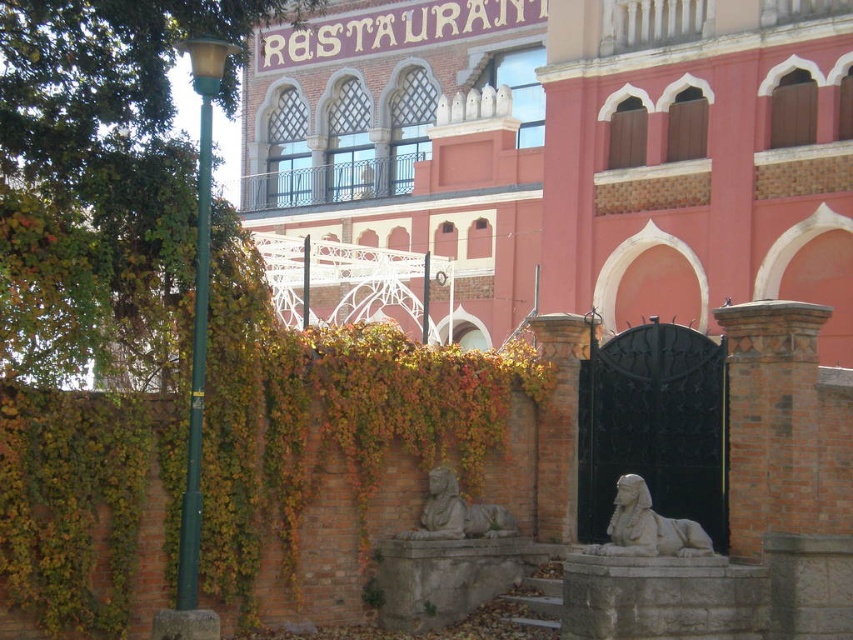
Consider the image. Is smooth stone sphinxes at center thinner than gray stone sphinx at center?

Incorrect, smooth stone sphinxes at center's width is not less than gray stone sphinx at center's.

The width and height of the screenshot is (853, 640). Identify the location of smooth stone sphinxes at center. (567, 150).

Can you confirm if white stone sphinx at lower right is bigger than gray stone sphinx at center?

Incorrect, white stone sphinx at lower right is not larger than gray stone sphinx at center.

Who is more forward, (619, 552) or (444, 528)?

Positioned in front is point (619, 552).

At what (x,y) coordinates should I click in order to perform the action: click on white stone sphinx at lower right. Please return your answer as a coordinate pair (x, y). The width and height of the screenshot is (853, 640). Looking at the image, I should click on (648, 525).

Is point (527, 64) positioned in front of point (692, 544)?

No.

This screenshot has width=853, height=640. What do you see at coordinates (567, 150) in the screenshot? I see `smooth stone sphinxes at center` at bounding box center [567, 150].

Locate an element on the screen. smooth stone sphinxes at center is located at coordinates (567, 150).